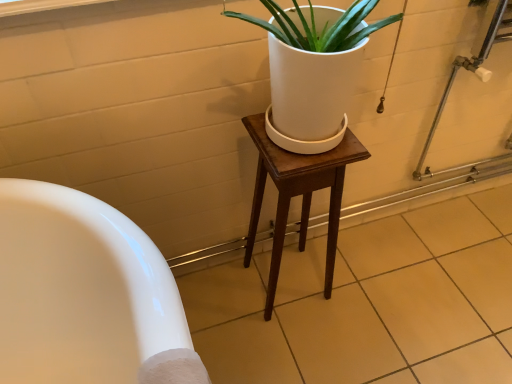
Locate an element on the screen. The width and height of the screenshot is (512, 384). free space in front of wooden stool at center is located at coordinates (292, 349).